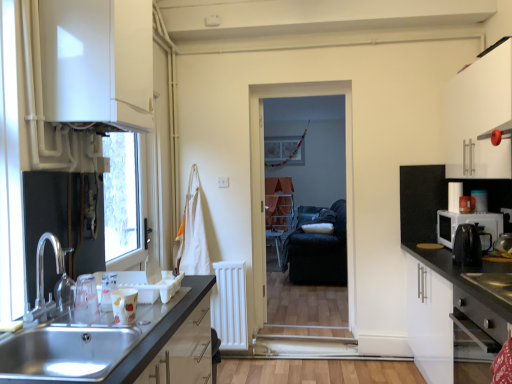
Find the location of a particular element. black stainless steel gas stove at lower right is located at coordinates (493, 284).

Measure the distance between point (141, 78) and camera.

6.37 feet.

What is the approximate height of silver metallic faucet at sink left?

silver metallic faucet at sink left is 32.01 centimeters in height.

Identify the location of black stainless steel gas stove at lower right. (493, 284).

Can you confirm if white glossy cabinet at upper left, which ranks as the first cabinetry in left-to-right order, is smaller than stainless steel oven at lower right?

Yes.

From the image's perspective, which one is positioned lower, white glossy cabinet at upper left, which ranks as the first cabinetry in left-to-right order, or stainless steel oven at lower right?

stainless steel oven at lower right.

Is white glossy cabinet at upper left, which is the 3th cabinetry in right-to-left order, facing towards stainless steel oven at lower right?

No, white glossy cabinet at upper left, which is the 3th cabinetry in right-to-left order, is not facing towards stainless steel oven at lower right.

Is black plastic kettle at right, which is the first appliance in back-to-front order, directly adjacent to black fabric screen door at center?

black plastic kettle at right, which is the first appliance in back-to-front order, and black fabric screen door at center are clearly separated.

Considering the positions of objects black plastic kettle at right, the second appliance from the front, and black fabric screen door at center in the image provided, who is more to the right, black plastic kettle at right, the second appliance from the front, or black fabric screen door at center?

black plastic kettle at right, the second appliance from the front, is more to the right.

Could you tell me if black plastic kettle at right, the second appliance from the front, is facing black fabric screen door at center?

Yes, black plastic kettle at right, the second appliance from the front, is aimed at black fabric screen door at center.

From a real-world perspective, is black plastic kettle at right, the second appliance from the front, below black fabric screen door at center?

Yes, from a real-world perspective, black plastic kettle at right, the second appliance from the front, is beneath black fabric screen door at center.

From a real-world perspective, which is physically above, black fabric armchair at center or white matte cabinet at right, positioned as the third cabinetry in top-to-bottom order?

In real-world perspective, black fabric armchair at center is above.

Is black fabric armchair at center at the right side of white matte cabinet at right, which is counted as the 2th cabinetry, starting from the left?

Incorrect, black fabric armchair at center is not on the right side of white matte cabinet at right, which is counted as the 2th cabinetry, starting from the left.

Is point (298, 276) farther from viewer compared to point (431, 180)?

Yes, it is behind point (431, 180).

From the picture: Is black fabric armchair at center outside of white matte cabinet at right, positioned as the third cabinetry in top-to-bottom order?

That's correct, black fabric armchair at center is outside of white matte cabinet at right, positioned as the third cabinetry in top-to-bottom order.

Is black plastic coffee machine at right to the left of black plastic kettle at right, placed as the 1th appliance when sorted from front to back, from the viewer's perspective?

Correct, you'll find black plastic coffee machine at right to the left of black plastic kettle at right, placed as the 1th appliance when sorted from front to back.

The height and width of the screenshot is (384, 512). I want to click on coffee machine positioned vertically above the black plastic kettle at right, placed as the 1th appliance when sorted from front to back (from a real-world perspective), so click(467, 246).

Can you confirm if black plastic coffee machine at right is taller than black plastic kettle at right, placed as the 1th appliance when sorted from front to back?

Yes.

Can you confirm if black plastic coffee machine at right is smaller than black plastic kettle at right, placed as the 1th appliance when sorted from front to back?

No.

Could you tell me if stainless steel sink at lower left is facing white matte cabinet at right, positioned as the third cabinetry in top-to-bottom order?

No.

From a real-world perspective, is stainless steel sink at lower left under white matte cabinet at right, positioned as the third cabinetry in top-to-bottom order?

Actually, stainless steel sink at lower left is physically above white matte cabinet at right, positioned as the third cabinetry in top-to-bottom order, in the real world.

Is stainless steel sink at lower left located outside white matte cabinet at right, which is counted as the 2th cabinetry, starting from the left?

Indeed, stainless steel sink at lower left is completely outside white matte cabinet at right, which is counted as the 2th cabinetry, starting from the left.

Does stainless steel sink at lower left appear on the left side of white matte cabinet at right, which ranks as the second cabinetry in right-to-left order?

Yes, stainless steel sink at lower left is to the left of white matte cabinet at right, which ranks as the second cabinetry in right-to-left order.

Does point (190, 210) come behind point (38, 266)?

Yes, point (190, 210) is behind point (38, 266).

Is white fabric laundry at center in contact with silver metallic faucet at sink left?

There is a gap between white fabric laundry at center and silver metallic faucet at sink left.

Considering the sizes of objects white fabric laundry at center and silver metallic faucet at sink left in the image provided, who is shorter, white fabric laundry at center or silver metallic faucet at sink left?

silver metallic faucet at sink left is shorter.

Considering the relative positions of white fabric laundry at center and silver metallic faucet at sink left in the image provided, is white fabric laundry at center to the left of silver metallic faucet at sink left from the viewer's perspective?

In fact, white fabric laundry at center is to the right of silver metallic faucet at sink left.

Which is more distant, (192,294) or (60,358)?

Positioned behind is point (192,294).

Is matte black countertop at lower left wider than stainless steel sink at lower left?

Yes, matte black countertop at lower left is wider than stainless steel sink at lower left.

From their relative heights in the image, would you say matte black countertop at lower left is taller or shorter than stainless steel sink at lower left?

In the image, matte black countertop at lower left appears to be taller than stainless steel sink at lower left.

In the scene shown: Is matte black countertop at lower left touching stainless steel sink at lower left?

No.

Image resolution: width=512 pixels, height=384 pixels. I want to click on cabinetry that appears on the left of stainless steel oven at lower right, so click(x=97, y=61).

I want to click on screen door that is above the black plastic kettle at right, which is the first appliance in back-to-front order (from the image's perspective), so click(264, 176).

Based on their spatial positions, is stainless steel oven at lower right or white fabric laundry at center closer to white glossy cabinet at upper left, which ranks as the first cabinetry in left-to-right order?

white fabric laundry at center is positioned closer to the anchor white glossy cabinet at upper left, which ranks as the first cabinetry in left-to-right order.

When comparing their distances from white fabric laundry at center, does black plastic kettle at right, placed as the 1th appliance when sorted from front to back, or white glossy cabinet at upper left, which ranks as the first cabinetry in left-to-right order, seem further?

Based on the image, black plastic kettle at right, placed as the 1th appliance when sorted from front to back, appears to be further to white fabric laundry at center.

Which object lies further to the anchor point silver metallic faucet at sink left, matte black countertop at lower left or black plastic kettle at right, the second appliance from the back?

Based on the image, black plastic kettle at right, the second appliance from the back, appears to be further to silver metallic faucet at sink left.

Considering their positions, is stainless steel sink at lower left positioned closer to white glossy cabinet at upper left, marked as the third cabinetry in a bottom-to-top arrangement, than white fabric laundry at center?

stainless steel sink at lower left.

Based on their spatial positions, is stainless steel sink at lower left or stainless steel oven at lower right further from black plastic coffee machine at right?

stainless steel sink at lower left.

From the image, which object appears to be farther from black fabric screen door at center, black plastic kettle at right, the second appliance from the back, or white fabric laundry at center?

black plastic kettle at right, the second appliance from the back, lies further to black fabric screen door at center than the other object.

Considering their positions, is white matte cabinet at right, positioned as the third cabinetry in top-to-bottom order, positioned further to wooden table at center than stainless steel sink at lower left?

stainless steel sink at lower left lies further to wooden table at center than the other object.

When comparing their distances from black fabric screen door at center, does wooden table at center or stainless steel sink at lower left seem further?

The object further to black fabric screen door at center is wooden table at center.

Find the location of a particular element. The image size is (512, 384). laundry located between white glossy cabinet at upper left, which ranks as the first cabinetry in left-to-right order, and black plastic coffee machine at right in the left-right direction is located at coordinates (192, 233).

The width and height of the screenshot is (512, 384). I want to click on coffee machine between white fabric laundry at center and black plastic kettle at right, placed as the 1th appliance when sorted from front to back, so click(x=467, y=246).

Where is `coffee machine located between white matte cabinet at right, which is the 1th cabinetry from bottom to top, and black fabric armchair at center in the depth direction`? coffee machine located between white matte cabinet at right, which is the 1th cabinetry from bottom to top, and black fabric armchair at center in the depth direction is located at coordinates (467, 246).

Find the location of a particular element. countertop between white glossy cabinet at upper left, marked as the first cabinetry in a top-to-bottom arrangement, and stainless steel oven at lower right from left to right is located at coordinates (120, 345).